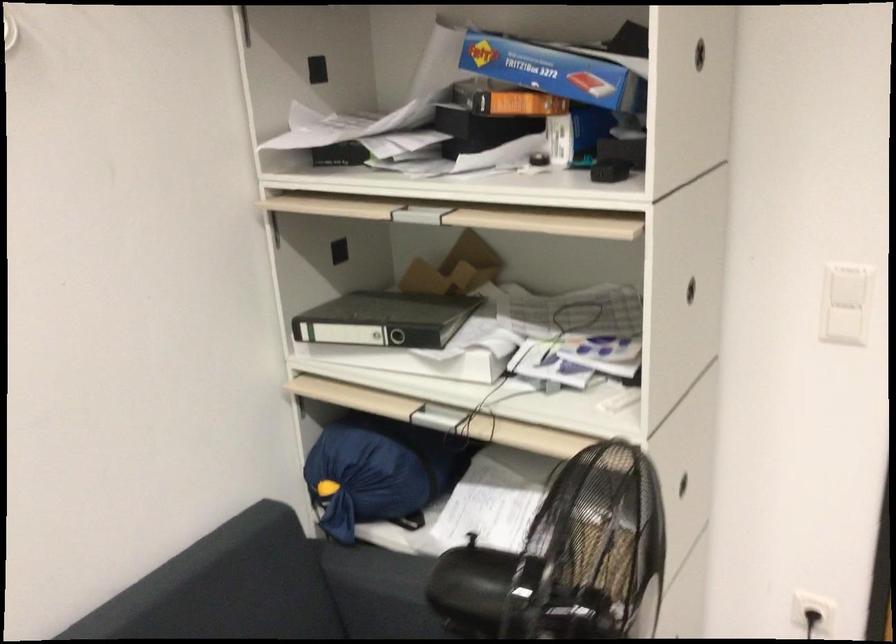
Which object does [376,471] point to?

It refers to a blue drawstring bag.